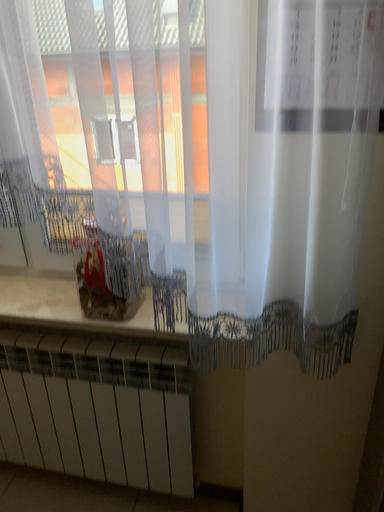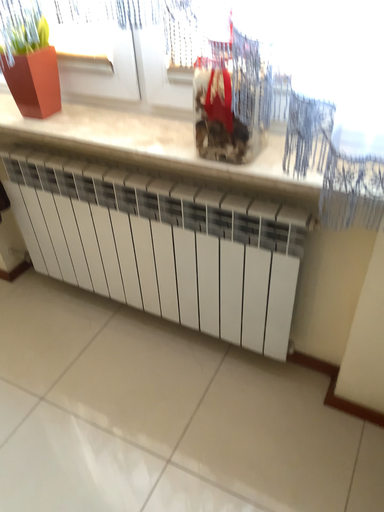
Question: Which way did the camera rotate in the video?

Choices:
 (A) rotated upward
 (B) rotated downward

Answer: (B)